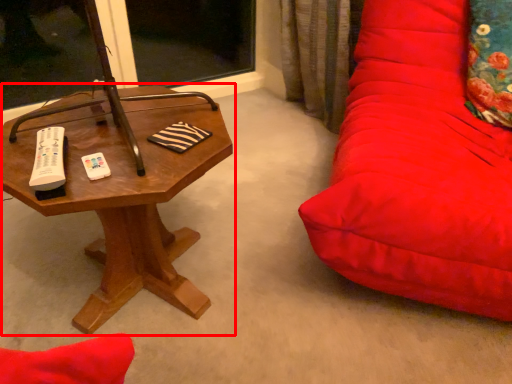
Question: From the image, what is the correct spatial relationship of table (annotated by the red box) in relation to throw pillow?

Choices:
 (A) left
 (B) right

Answer: (A)